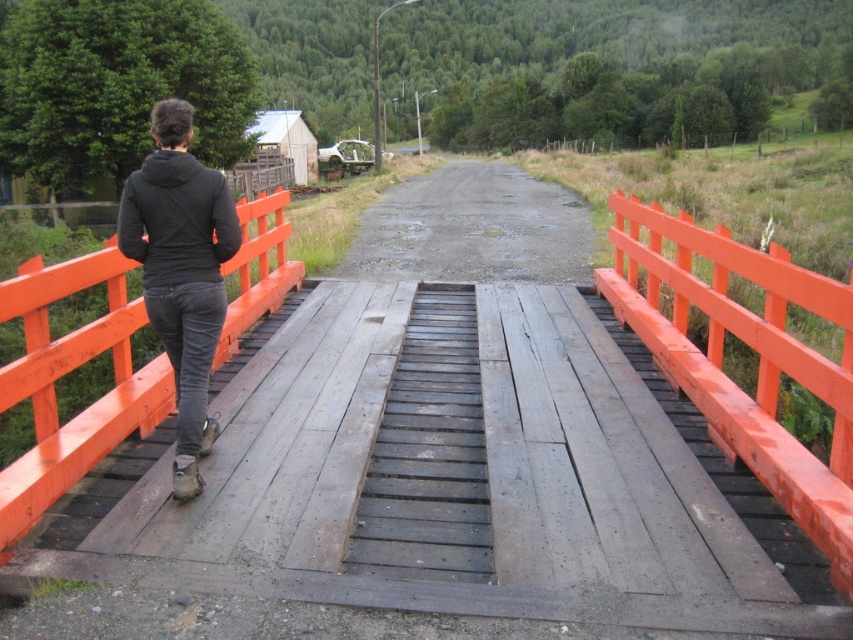
You are a photographer positioned on the wooden bridge. You notice the orange painted wood at center and the black matte jacket at center. Which object would appear larger in your camera viewfinder?

The orange painted wood at center would appear larger in the camera viewfinder because it is closer to the viewer than the black matte jacket at center.

You are a photographer trying to capture the black matte jacket at center and the orange painted wood at center in the same frame. Based on their positions, which object should you adjust your camera to focus on first to ensure both are in the shot?

The orange painted wood at center is positioned on the right side of black matte jacket at center. To capture both in the same frame, focus on the black matte jacket at center first as it is closer to the center and adjust the camera angle to include the orange painted wood at center to the right.

You are a photographer trying to capture a shot of the black matte jacket at upper left and the orange painted wood at left. Based on their positions, which object should you adjust your camera to focus on first to ensure both are in frame?

The orange painted wood at left is to the left of black matte jacket at upper left, so you should focus on the orange painted wood at left first to ensure both are in frame.